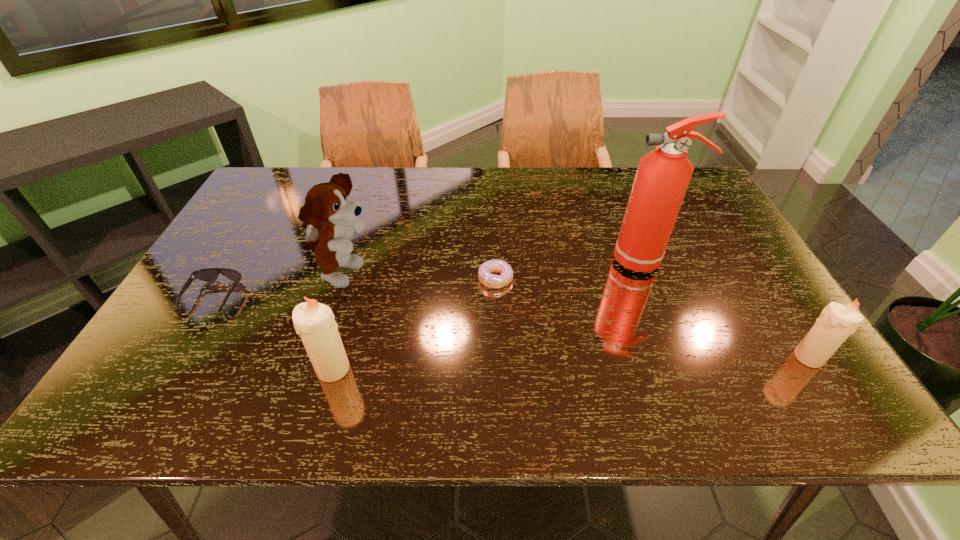
Locate an element on the screen. the third tallest object is located at coordinates (314, 322).

You are a GUI agent. You are given a task and a screenshot of the screen. Output one action in this format:
    pyautogui.click(x=<x>, y=<y>)
    Task: Click on the taller candle
    Image resolution: width=960 pixels, height=540 pixels.
    Given the screenshot: What is the action you would take?
    pyautogui.click(x=314, y=322)

I want to click on the rightmost object, so click(837, 322).

At what (x,y) coordinates should I click in order to perform the action: click on the third shortest object. Please return your answer as a coordinate pair (x, y). This screenshot has width=960, height=540. Looking at the image, I should click on (837, 322).

Find the location of a particular element. the fourth object from left to right is located at coordinates (489, 280).

Image resolution: width=960 pixels, height=540 pixels. In order to click on the fifth object from left to right in this screenshot , I will do `click(662, 178)`.

Identify the location of fire extinguisher. The width and height of the screenshot is (960, 540). (662, 178).

Find the location of `sunglasses`. sunglasses is located at coordinates (208, 274).

Identify the location of puppy. (331, 219).

The width and height of the screenshot is (960, 540). Find the location of `vacant position located on the back of the taller candle`. vacant position located on the back of the taller candle is located at coordinates (368, 246).